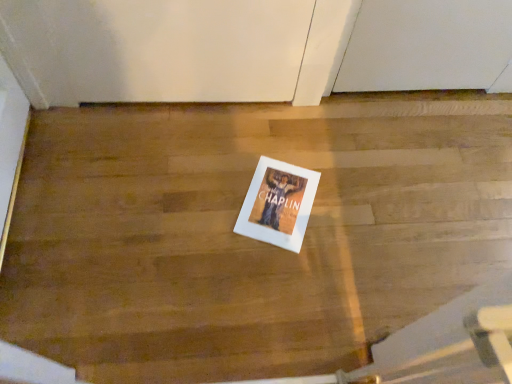
Image resolution: width=512 pixels, height=384 pixels. I want to click on free space to the back side of white paper at center, so (283, 134).